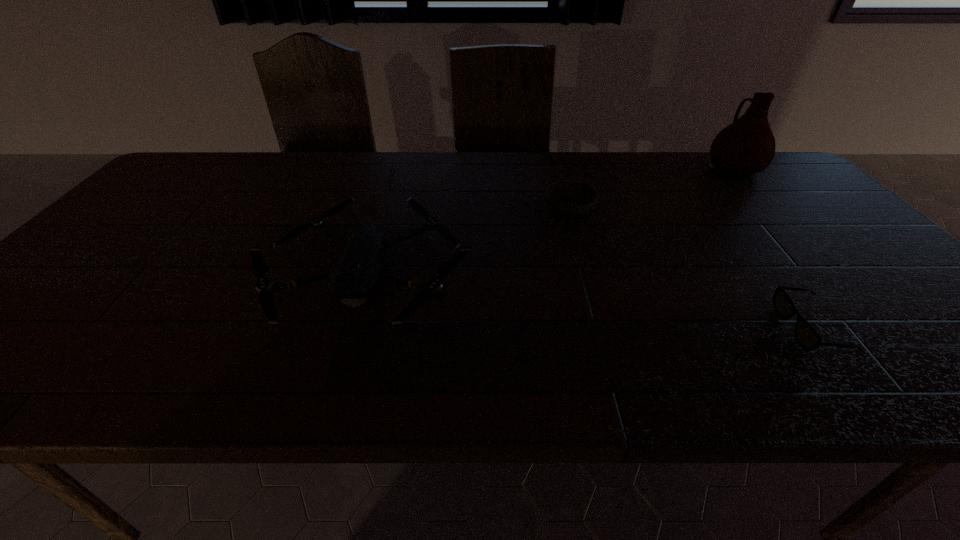
In order to click on free space between the leftmost object and the second object from left to right in this screenshot , I will do `click(468, 239)`.

Identify the location of free space between the sunglasses and the third object from right to left. (689, 269).

This screenshot has height=540, width=960. What are the coordinates of `blank region between the second object from left to right and the pitcher` in the screenshot? It's located at (651, 189).

Where is `blank region between the bowl and the tallest object`? The image size is (960, 540). blank region between the bowl and the tallest object is located at coordinates (651, 189).

Where is `free space between the rightmost object and the sunglasses`? free space between the rightmost object and the sunglasses is located at coordinates point(772,248).

This screenshot has width=960, height=540. I want to click on empty space between the second object from left to right and the pitcher, so click(x=651, y=189).

Find the location of a particular element. empty location between the second object from left to right and the leftmost object is located at coordinates (468, 239).

You are a GUI agent. You are given a task and a screenshot of the screen. Output one action in this format:
    pyautogui.click(x=<x>, y=<y>)
    Task: Click on the empty space between the drone and the sunglasses
    Image resolution: width=960 pixels, height=540 pixels.
    Given the screenshot: What is the action you would take?
    pyautogui.click(x=588, y=299)

The height and width of the screenshot is (540, 960). In order to click on vacant region between the drone and the bowl in this screenshot , I will do `click(468, 239)`.

Identify the location of free space between the third shortest object and the third object from left to right. (588, 299).